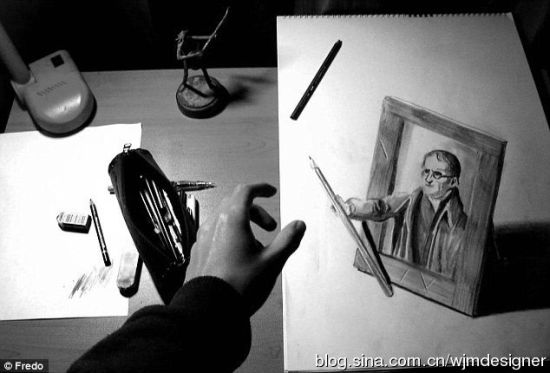
Where is `picture frame`? This screenshot has width=550, height=373. picture frame is located at coordinates (476, 251).